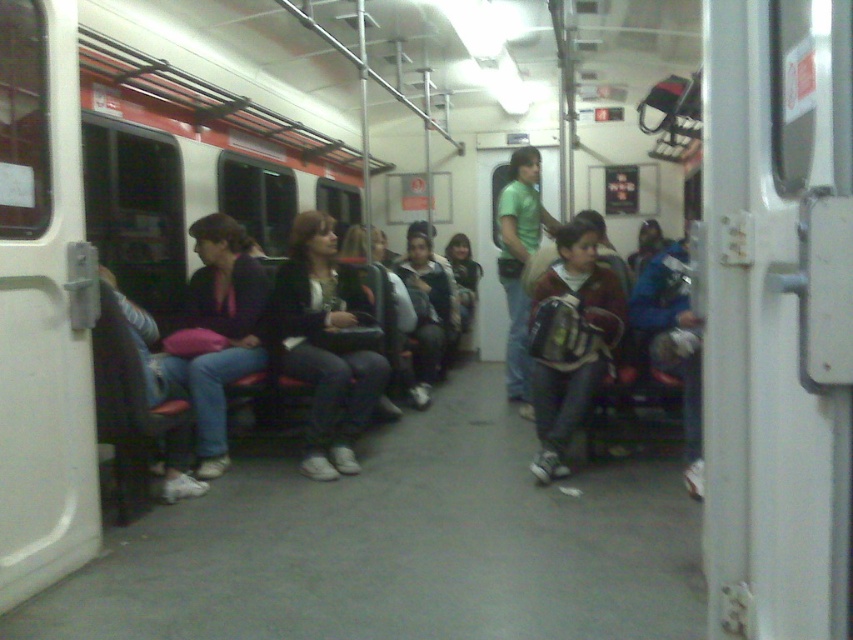
Question: Based on their relative distances, which object is nearer to the matte black jacket at left?

Choices:
 (A) matte black jacket at center
 (B) green matte shirt at center

Answer: (A)

Question: Which object appears closest to the camera in this image?

Choices:
 (A) matte black jacket at left
 (B) matte black jacket at center
 (C) green matte shirt at center
 (D) dark brown backpack at center

Answer: (D)

Question: Which of the following is the closest to the observer?

Choices:
 (A) matte black jacket at left
 (B) matte black jacket at center

Answer: (A)

Question: In this image, where is matte black jacket at center located relative to green matte shirt at center?

Choices:
 (A) below
 (B) above

Answer: (A)

Question: Is matte black jacket at center below green matte shirt at center?

Choices:
 (A) no
 (B) yes

Answer: (B)

Question: Does dark brown backpack at center have a greater width compared to matte black jacket at left?

Choices:
 (A) yes
 (B) no

Answer: (A)